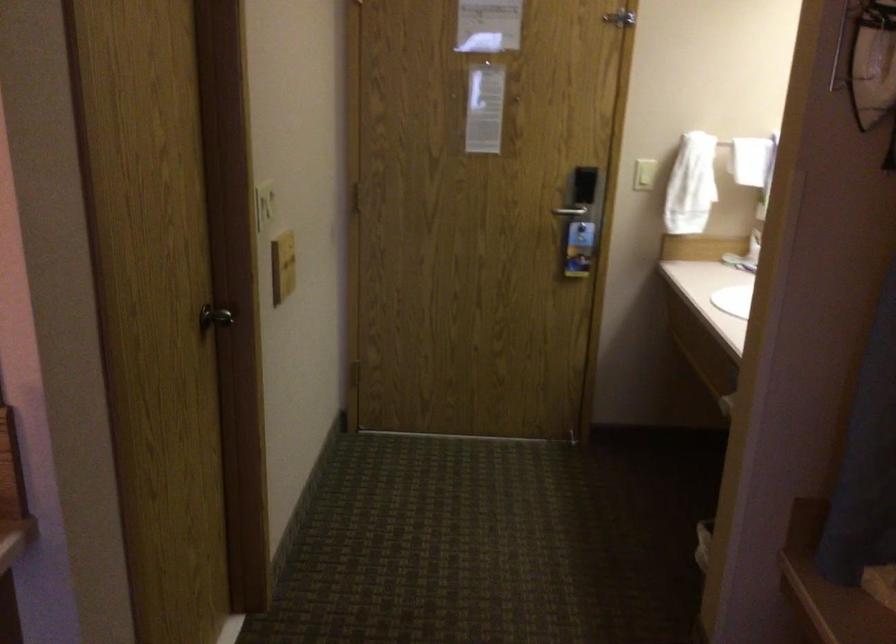
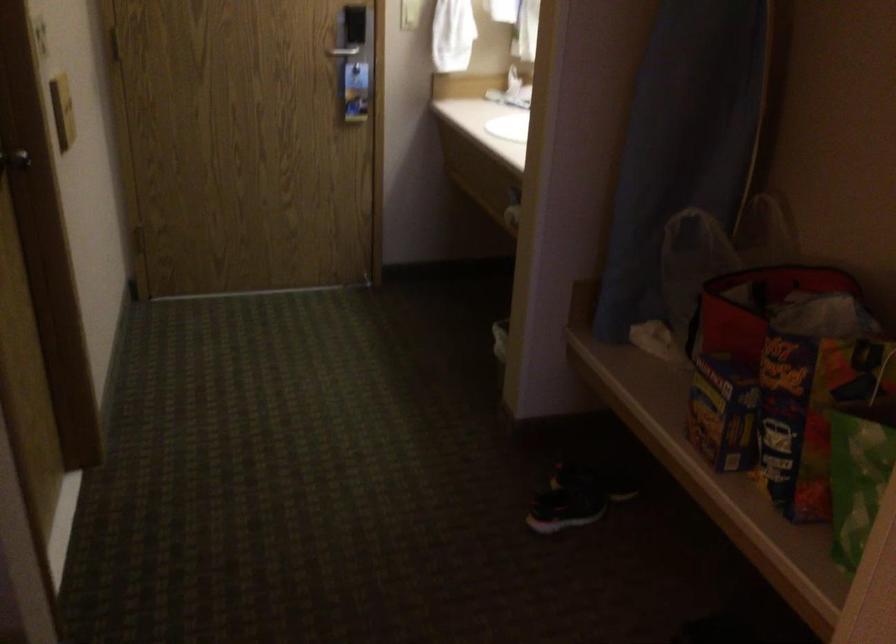
In a continuous first-person perspective shot, in which direction is the camera moving?

The cameraman moved toward left, backward.